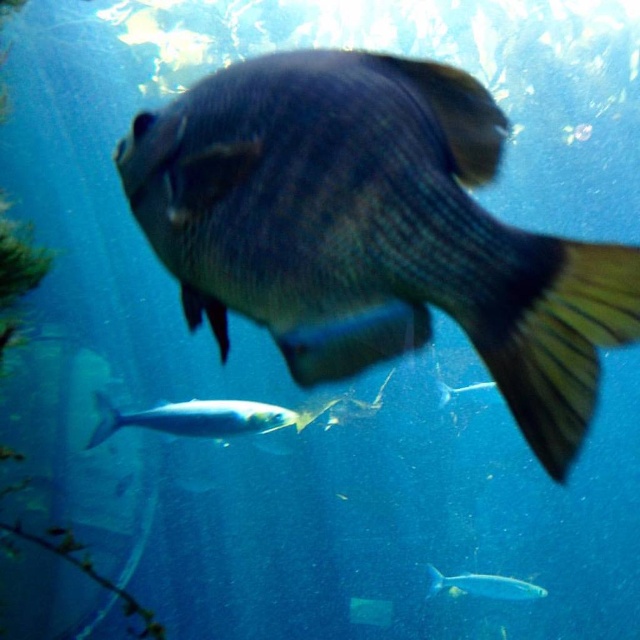
At what (x,y) coordinates should I click in order to perform the action: click on shiny silver fish at lower center. Please return your answer as a coordinate pair (x, y). Image resolution: width=640 pixels, height=640 pixels. Looking at the image, I should click on (204, 417).

Does point (97, 410) come farther from viewer compared to point (456, 586)?

Yes, it is.

This screenshot has width=640, height=640. Describe the element at coordinates (204, 417) in the screenshot. I see `shiny silver fish at lower center` at that location.

Find the location of `shiny silver fish at lower center`. shiny silver fish at lower center is located at coordinates (204, 417).

Is point (401, 316) in front of point (104, 428)?

Yes, it is in front of point (104, 428).

Is shiny blue fish at center in front of shiny silver fish at lower center?

Yes.

The image size is (640, 640). What do you see at coordinates (372, 230) in the screenshot?
I see `shiny blue fish at center` at bounding box center [372, 230].

I want to click on shiny blue fish at center, so click(x=372, y=230).

Does point (589, 296) come behind point (481, 593)?

That is False.

How far apart are shiny blue fish at center and shiny silver fish at center?

They are 4.74 meters apart.

Does point (336, 282) lie behind point (435, 582)?

No.

The height and width of the screenshot is (640, 640). Find the location of `shiny blue fish at center`. shiny blue fish at center is located at coordinates (372, 230).